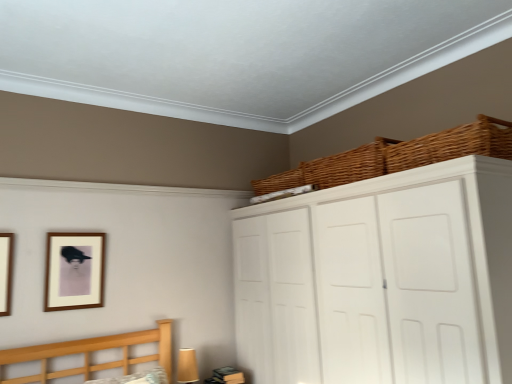
This screenshot has height=384, width=512. What do you see at coordinates (380, 279) in the screenshot?
I see `white matte cupboard at upper right` at bounding box center [380, 279].

In order to face woven brown basket at upper right, arranged as the third basket when viewed from the back, should I rotate leftwards or rightwards?

To face it directly, rotate right by 23.941 degrees.

Where is `woven brown basket at upper center, the 2th basket viewed from the back`? Image resolution: width=512 pixels, height=384 pixels. woven brown basket at upper center, the 2th basket viewed from the back is located at coordinates (331, 169).

Locate an element on the screen. matte brown picture frame at upper left, arranged as the 1th picture frame when viewed from the back is located at coordinates (74, 271).

I want to click on woven brown basket at upper center, which is the 1th basket in back-to-front order, so click(279, 182).

Is matte brown picture frame at upper left, which is the 1th picture frame in right-to-left order, to the left of wooden picture frame at left, marked as the first picture frame in a left-to-right arrangement, from the viewer's perspective?

Incorrect, matte brown picture frame at upper left, which is the 1th picture frame in right-to-left order, is not on the left side of wooden picture frame at left, marked as the first picture frame in a left-to-right arrangement.

Is matte brown picture frame at upper left, arranged as the 1th picture frame when viewed from the back, smaller than wooden picture frame at left, marked as the first picture frame in a left-to-right arrangement?

No, matte brown picture frame at upper left, arranged as the 1th picture frame when viewed from the back, is not smaller than wooden picture frame at left, marked as the first picture frame in a left-to-right arrangement.

Which object is closer to the camera, matte brown picture frame at upper left, arranged as the 1th picture frame when viewed from the back, or wooden picture frame at left, marked as the first picture frame in a left-to-right arrangement?

wooden picture frame at left, marked as the first picture frame in a left-to-right arrangement, is more forward.

Is white matte cupboard at upper right in front of wooden picture frame at left, which appears as the 2th picture frame when viewed from the right?

Yes, white matte cupboard at upper right is closer to the viewer.

Does white matte cupboard at upper right turn towards wooden picture frame at left, which appears as the 2th picture frame when viewed from the right?

Yes.

Is matte brown picture frame at upper left, which appears as the second picture frame when viewed from the left, to the right of woven brown basket at upper center, which is the second basket from front to back, from the viewer's perspective?

In fact, matte brown picture frame at upper left, which appears as the second picture frame when viewed from the left, is to the left of woven brown basket at upper center, which is the second basket from front to back.

How different are the orientations of matte brown picture frame at upper left, which is the 1th picture frame in right-to-left order, and woven brown basket at upper center, which is the second basket from front to back, in degrees?

There is a 89-degree angle between the facing directions of matte brown picture frame at upper left, which is the 1th picture frame in right-to-left order, and woven brown basket at upper center, which is the second basket from front to back.

Considering the sizes of objects matte brown picture frame at upper left, arranged as the 1th picture frame when viewed from the back, and woven brown basket at upper center, the 2th basket viewed from the back, in the image provided, who is shorter, matte brown picture frame at upper left, arranged as the 1th picture frame when viewed from the back, or woven brown basket at upper center, the 2th basket viewed from the back,?

woven brown basket at upper center, the 2th basket viewed from the back.

Consider the image. Does matte brown picture frame at upper left, arranged as the 1th picture frame when viewed from the back, lie in front of woven brown basket at upper center, the 2th basket viewed from the back?

No.

From a real-world perspective, is woven brown basket at upper right, which is counted as the first basket, starting from the front, on white matte cupboard at upper right?

Correct, in the physical world, woven brown basket at upper right, which is counted as the first basket, starting from the front, is higher than white matte cupboard at upper right.

Considering their positions, is woven brown basket at upper right, which is counted as the first basket, starting from the front, located in front of or behind white matte cupboard at upper right?

Clearly, woven brown basket at upper right, which is counted as the first basket, starting from the front, is behind white matte cupboard at upper right.

Is woven brown basket at upper right, which is counted as the first basket, starting from the front, taller than white matte cupboard at upper right?

No, woven brown basket at upper right, which is counted as the first basket, starting from the front, is not taller than white matte cupboard at upper right.

Image resolution: width=512 pixels, height=384 pixels. Find the location of `basket on the right of white matte cupboard at upper right`. basket on the right of white matte cupboard at upper right is located at coordinates (451, 145).

Who is smaller, woven brown basket at upper center, which is counted as the 3th basket, starting from the front, or woven brown basket at upper center, the 2th basket viewed from the back?

woven brown basket at upper center, which is counted as the 3th basket, starting from the front, is smaller.

How many degrees apart are the facing directions of woven brown basket at upper center, which is counted as the 3th basket, starting from the front, and woven brown basket at upper center, the 2th basket viewed from the back?

They differ by 1.6 degrees in their facing directions.

Does woven brown basket at upper center, which is counted as the 3th basket, starting from the front, come in front of woven brown basket at upper center, which is the second basket from front to back?

No.

Is woven brown basket at upper center, which is counted as the 3th basket, starting from the front, in contact with woven brown basket at upper center, the 2th basket viewed from the back?

They are not placed beside each other.

Looking at this image, from the image's perspective, is woven brown basket at upper center, which is counted as the 3th basket, starting from the front, below white matte cupboard at upper right?

No.

Which object is positioned more to the right, woven brown basket at upper center, which is the 1th basket in back-to-front order, or white matte cupboard at upper right?

From the viewer's perspective, white matte cupboard at upper right appears more on the right side.

Does woven brown basket at upper center, which is the 1th basket in back-to-front order, have a greater height compared to white matte cupboard at upper right?

No.

The height and width of the screenshot is (384, 512). I want to click on the 3rd basket directly above the white matte cupboard at upper right (from a real-world perspective), so click(279, 182).

Is wooden picture frame at left, the first picture frame from the front, not near matte brown picture frame at upper left, which appears as the second picture frame when viewed from the left?

No, wooden picture frame at left, the first picture frame from the front, is in close proximity to matte brown picture frame at upper left, which appears as the second picture frame when viewed from the left.

In terms of width, does wooden picture frame at left, the first picture frame from the front, look wider or thinner when compared to matte brown picture frame at upper left, arranged as the second picture frame when viewed from the front?

In the image, wooden picture frame at left, the first picture frame from the front, appears to be more narrow than matte brown picture frame at upper left, arranged as the second picture frame when viewed from the front.

Considering the positions of objects wooden picture frame at left, which appears as the 2th picture frame when viewed from the right, and matte brown picture frame at upper left, arranged as the 1th picture frame when viewed from the back, in the image provided, who is more to the right, wooden picture frame at left, which appears as the 2th picture frame when viewed from the right, or matte brown picture frame at upper left, arranged as the 1th picture frame when viewed from the back,?

matte brown picture frame at upper left, arranged as the 1th picture frame when viewed from the back, is more to the right.

From the image's perspective, is wooden picture frame at left, marked as the first picture frame in a left-to-right arrangement, above or below matte brown picture frame at upper left, arranged as the second picture frame when viewed from the front?

From the image's perspective, wooden picture frame at left, marked as the first picture frame in a left-to-right arrangement, appears above matte brown picture frame at upper left, arranged as the second picture frame when viewed from the front.

In the image, there is a matte brown picture frame at upper left, which is the 1th picture frame in right-to-left order. Identify the location of picture frame above it (from the image's perspective). The image size is (512, 384). (6, 272).

The height and width of the screenshot is (384, 512). What are the coordinates of `cupboard below the wooden picture frame at left, the first picture frame from the front (from a real-world perspective)` in the screenshot? It's located at (380, 279).

Based on their spatial positions, is matte brown picture frame at upper left, arranged as the second picture frame when viewed from the front, or woven brown basket at upper center, the 2th basket viewed from the back, closer to white matte cupboard at upper right?

Based on the image, woven brown basket at upper center, the 2th basket viewed from the back, appears to be nearer to white matte cupboard at upper right.

Based on their spatial positions, is white matte cupboard at upper right or woven brown basket at upper center, which is counted as the 3th basket, starting from the front, closer to woven brown basket at upper right, arranged as the third basket when viewed from the back?

The object closer to woven brown basket at upper right, arranged as the third basket when viewed from the back, is white matte cupboard at upper right.

Considering their positions, is woven brown basket at upper center, which is the second basket from front to back, positioned further to wooden picture frame at left, the first picture frame from the front, than woven brown basket at upper right, arranged as the third basket when viewed from the back?

woven brown basket at upper right, arranged as the third basket when viewed from the back, lies further to wooden picture frame at left, the first picture frame from the front, than the other object.

When comparing their distances from woven brown basket at upper right, which is counted as the first basket, starting from the front, does wooden picture frame at left, marked as the first picture frame in a left-to-right arrangement, or matte brown picture frame at upper left, arranged as the 1th picture frame when viewed from the back, seem further?

wooden picture frame at left, marked as the first picture frame in a left-to-right arrangement, is positioned further to the anchor woven brown basket at upper right, which is counted as the first basket, starting from the front.

From the image, which object appears to be farther from woven brown basket at upper center, the 2th basket viewed from the back, woven brown basket at upper center, which is counted as the 3th basket, starting from the front, or white matte cupboard at upper right?

Among the two, white matte cupboard at upper right is located further to woven brown basket at upper center, the 2th basket viewed from the back.

Considering their positions, is wooden picture frame at left, which appears as the 2th picture frame when viewed from the right, positioned further to woven brown basket at upper center, which is counted as the 3th basket, starting from the front, than white matte cupboard at upper right?

wooden picture frame at left, which appears as the 2th picture frame when viewed from the right.

From the image, which object appears to be farther from woven brown basket at upper center, the 2th basket viewed from the back, woven brown basket at upper center, which is the 1th basket in back-to-front order, or wooden picture frame at left, the first picture frame from the front?

Based on the image, wooden picture frame at left, the first picture frame from the front, appears to be further to woven brown basket at upper center, the 2th basket viewed from the back.

Estimate the real-world distances between objects in this image. Which object is further from woven brown basket at upper center, which is the 1th basket in back-to-front order, woven brown basket at upper center, which is the second basket from front to back, or woven brown basket at upper right, arranged as the third basket when viewed from the back?

woven brown basket at upper right, arranged as the third basket when viewed from the back, is positioned further to the anchor woven brown basket at upper center, which is the 1th basket in back-to-front order.

The image size is (512, 384). I want to click on basket located between wooden picture frame at left, which appears as the 2th picture frame when viewed from the right, and woven brown basket at upper center, which is the second basket from front to back, in the left-right direction, so click(x=279, y=182).

Locate an element on the screen. This screenshot has height=384, width=512. picture frame located between wooden picture frame at left, acting as the second picture frame starting from the back, and woven brown basket at upper right, which is counted as the first basket, starting from the front, in the left-right direction is located at coordinates (74, 271).

Locate an element on the screen. The width and height of the screenshot is (512, 384). picture frame between wooden picture frame at left, acting as the second picture frame starting from the back, and woven brown basket at upper center, which is the 1th basket in back-to-front order, in the horizontal direction is located at coordinates (74, 271).

Where is `cupboard situated between wooden picture frame at left, acting as the second picture frame starting from the back, and woven brown basket at upper right, arranged as the third basket when viewed from the back, from left to right`? Image resolution: width=512 pixels, height=384 pixels. cupboard situated between wooden picture frame at left, acting as the second picture frame starting from the back, and woven brown basket at upper right, arranged as the third basket when viewed from the back, from left to right is located at coordinates coord(380,279).